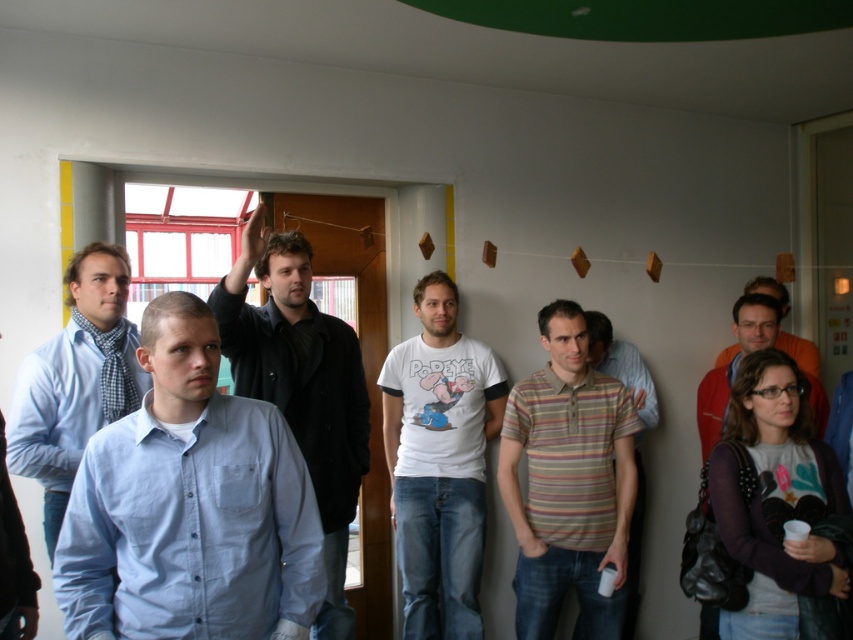
Question: Which object appears closest to the camera in this image?

Choices:
 (A) light blue cotton shirt at left
 (B) striped cotton polo shirt at center

Answer: (A)

Question: Which point is closer to the camera?

Choices:
 (A) (450, 506)
 (B) (131, 372)
 (C) (711, 372)
 (D) (596, 340)

Answer: (B)

Question: Does black matte coat at center have a larger size compared to light blue shirt at left?

Choices:
 (A) no
 (B) yes

Answer: (B)

Question: Is striped cotton polo shirt at center below light blue shirt at left?

Choices:
 (A) no
 (B) yes

Answer: (B)

Question: Estimate the real-world distances between objects in this image. Which object is closer to the orange cotton shirt at center?

Choices:
 (A) matte purple sweater at right
 (B) light blue cotton shirt at left
 (C) light blue shirt at left
 (D) white cotton t-shirt at center

Answer: (A)

Question: Is striped cotton shirt at center thinner than orange cotton shirt at center?

Choices:
 (A) yes
 (B) no

Answer: (A)